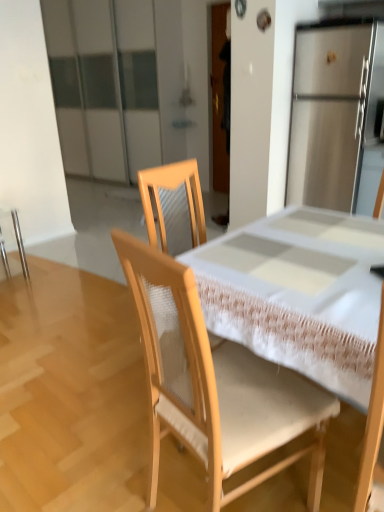
What is the approximate height of metallic silver chair at left, which is the 2th chair in right-to-left order?

metallic silver chair at left, which is the 2th chair in right-to-left order, is 20.07 inches tall.

What do you see at coordinates (20, 243) in the screenshot? The image size is (384, 512). I see `metallic silver chair at left, the first chair positioned from the back` at bounding box center [20, 243].

The image size is (384, 512). In order to click on metallic silver chair at left, which is counted as the second chair, starting from the front in this screenshot , I will do `click(20, 243)`.

The image size is (384, 512). What are the coordinates of `wooden chair at center, the 2th chair viewed from the back` in the screenshot? It's located at (216, 384).

Measure the distance between point [216,467] and camera.

The distance of point [216,467] from camera is 3.68 feet.

Image resolution: width=384 pixels, height=512 pixels. Describe the element at coordinates (216, 384) in the screenshot. I see `wooden chair at center, the 1th chair viewed from the right` at that location.

Locate an element on the screen. The width and height of the screenshot is (384, 512). metallic silver chair at left, which is counted as the second chair, starting from the front is located at coordinates (20, 243).

Which is more to the right, wooden chair at center, the 1th chair viewed from the right, or metallic silver chair at left, which is the 2th chair in right-to-left order?

From the viewer's perspective, wooden chair at center, the 1th chair viewed from the right, appears more on the right side.

Considering their positions, is wooden chair at center, which is the 1th chair in front-to-back order, located in front of or behind metallic silver chair at left, which is the 2th chair in right-to-left order?

Visually, wooden chair at center, which is the 1th chair in front-to-back order, is located in front of metallic silver chair at left, which is the 2th chair in right-to-left order.

Considering the positions of points (277, 404) and (19, 236), is point (277, 404) farther from camera compared to point (19, 236)?

No, it is in front of (19, 236).

From the image's perspective, who appears lower, wooden chair at center, the 2th chair viewed from the back, or metallic silver chair at left, which is counted as the second chair, starting from the front?

wooden chair at center, the 2th chair viewed from the back, is shown below in the image.

From a real-world perspective, is wooden chair at center, the 2th chair viewed from the back, positioned above or below metallic silver chair at left, the 1th chair positioned from the left?

In terms of real-world spatial position, wooden chair at center, the 2th chair viewed from the back, is above metallic silver chair at left, the 1th chair positioned from the left.

Between wooden chair at center, the 1th chair viewed from the right, and metallic silver chair at left, which is the 2th chair in right-to-left order, which one has larger width?

With larger width is wooden chair at center, the 1th chair viewed from the right.

Considering the sizes of objects wooden chair at center, which is the 1th chair in front-to-back order, and metallic silver chair at left, the 1th chair positioned from the left, in the image provided, who is taller, wooden chair at center, which is the 1th chair in front-to-back order, or metallic silver chair at left, the 1th chair positioned from the left,?

wooden chair at center, which is the 1th chair in front-to-back order.

Between wooden chair at center, the 2th chair viewed from the back, and metallic silver chair at left, the 1th chair positioned from the left, which one has larger size?

wooden chair at center, the 2th chair viewed from the back.

Would you say wooden chair at center, the 1th chair viewed from the right, contains metallic silver chair at left, the 1th chair positioned from the left?

That's incorrect, metallic silver chair at left, the 1th chair positioned from the left, is not inside wooden chair at center, the 1th chair viewed from the right.

Are wooden chair at center, the 2th chair viewed from the back, and metallic silver chair at left, the first chair positioned from the back, beside each other?

wooden chair at center, the 2th chair viewed from the back, and metallic silver chair at left, the first chair positioned from the back, are clearly separated.

Looking at this image, is metallic silver chair at left, which is counted as the second chair, starting from the front, at the back of wooden chair at center, which is the 1th chair in front-to-back order?

No.

How different are the orientations of wooden chair at center, the 1th chair viewed from the right, and metallic silver chair at left, which is the 2th chair in right-to-left order, in degrees?

The angle between the facing direction of wooden chair at center, the 1th chair viewed from the right, and the facing direction of metallic silver chair at left, which is the 2th chair in right-to-left order, is 79.1 degrees.

Measure the distance from wooden chair at center, the 2th chair viewed from the back, to metallic silver chair at left, the 1th chair positioned from the left.

7.55 feet.

Locate an element on the screen. chair to the right of metallic silver chair at left, the first chair positioned from the back is located at coordinates (216, 384).

Can you confirm if metallic silver chair at left, the first chair positioned from the back, is positioned to the right of wooden chair at center, which is the 1th chair in front-to-back order?

No, metallic silver chair at left, the first chair positioned from the back, is not to the right of wooden chair at center, which is the 1th chair in front-to-back order.

Considering the relative positions of metallic silver chair at left, which is the 2th chair in right-to-left order, and wooden chair at center, the 2th chair viewed from the back, in the image provided, is metallic silver chair at left, which is the 2th chair in right-to-left order, in front of wooden chair at center, the 2th chair viewed from the back,?

No, metallic silver chair at left, which is the 2th chair in right-to-left order, is behind wooden chair at center, the 2th chair viewed from the back.

Which point is more forward, (20, 233) or (239, 383)?

The point (239, 383) is in front.

From the image's perspective, is metallic silver chair at left, which is counted as the second chair, starting from the front, located above wooden chair at center, the 1th chair viewed from the right?

Correct, metallic silver chair at left, which is counted as the second chair, starting from the front, appears higher than wooden chair at center, the 1th chair viewed from the right, in the image.

From a real-world perspective, is metallic silver chair at left, the first chair positioned from the back, positioned under wooden chair at center, positioned as the 2th chair in left-to-right order, based on gravity?

Correct, in the physical world, metallic silver chair at left, the first chair positioned from the back, is lower than wooden chair at center, positioned as the 2th chair in left-to-right order.

Considering the sizes of objects metallic silver chair at left, which is counted as the second chair, starting from the front, and wooden chair at center, the 1th chair viewed from the right, in the image provided, who is wider, metallic silver chair at left, which is counted as the second chair, starting from the front, or wooden chair at center, the 1th chair viewed from the right,?

wooden chair at center, the 1th chair viewed from the right.

Which of these two, metallic silver chair at left, which is the 2th chair in right-to-left order, or wooden chair at center, the 2th chair viewed from the back, stands taller?

With more height is wooden chair at center, the 2th chair viewed from the back.

Considering the relative sizes of metallic silver chair at left, which is the 2th chair in right-to-left order, and wooden chair at center, positioned as the 2th chair in left-to-right order, in the image provided, is metallic silver chair at left, which is the 2th chair in right-to-left order, bigger than wooden chair at center, positioned as the 2th chair in left-to-right order,?

Actually, metallic silver chair at left, which is the 2th chair in right-to-left order, might be smaller than wooden chair at center, positioned as the 2th chair in left-to-right order.

Which is correct: metallic silver chair at left, which is counted as the second chair, starting from the front, is inside wooden chair at center, which is the 1th chair in front-to-back order, or outside of it?

metallic silver chair at left, which is counted as the second chair, starting from the front, exists outside the volume of wooden chair at center, which is the 1th chair in front-to-back order.

Are metallic silver chair at left, which is counted as the second chair, starting from the front, and wooden chair at center, the 2th chair viewed from the back, making contact?

No, metallic silver chair at left, which is counted as the second chair, starting from the front, is not with wooden chair at center, the 2th chair viewed from the back.

Is wooden chair at center, which is the 1th chair in front-to-back order, at the back of metallic silver chair at left, the 1th chair positioned from the left?

metallic silver chair at left, the 1th chair positioned from the left, does not have its back to wooden chair at center, which is the 1th chair in front-to-back order.

This screenshot has width=384, height=512. I want to click on chair that appears in front of the metallic silver chair at left, which is the 2th chair in right-to-left order, so click(x=216, y=384).

The height and width of the screenshot is (512, 384). Find the location of `chair located on the left of wooden chair at center, the 2th chair viewed from the back`. chair located on the left of wooden chair at center, the 2th chair viewed from the back is located at coordinates (20, 243).

Where is `chair below the metallic silver chair at left, the first chair positioned from the back (from the image's perspective)`? This screenshot has width=384, height=512. chair below the metallic silver chair at left, the first chair positioned from the back (from the image's perspective) is located at coordinates (216, 384).